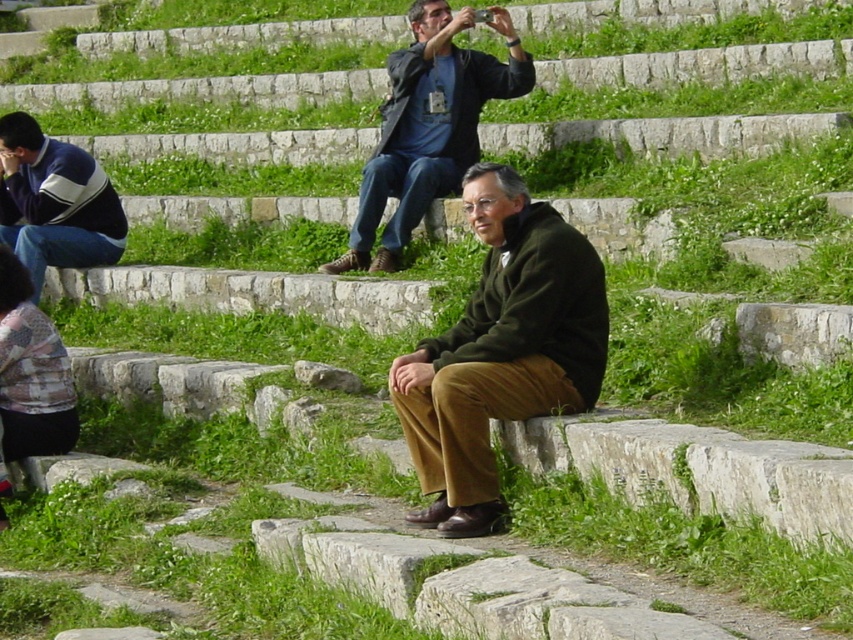
Question: Which point is farther from the camera taking this photo?

Choices:
 (A) (380, 132)
 (B) (71, 150)
 (C) (541, 410)

Answer: (A)

Question: Is dark green sweater at center above dark blue jacket at upper center?

Choices:
 (A) yes
 (B) no

Answer: (B)

Question: Is dark blue jacket at upper center to the right of blue and white sweater at left from the viewer's perspective?

Choices:
 (A) yes
 (B) no

Answer: (A)

Question: Does dark green sweater at center appear on the right side of blue and white sweater at left?

Choices:
 (A) no
 (B) yes

Answer: (B)

Question: Estimate the real-world distances between objects in this image. Which object is closer to the dark blue jacket at upper center?

Choices:
 (A) dark green sweater at center
 (B) blue and white sweater at left

Answer: (B)

Question: Which point is farther to the camera?

Choices:
 (A) dark blue jacket at upper center
 (B) dark green sweater at center

Answer: (A)